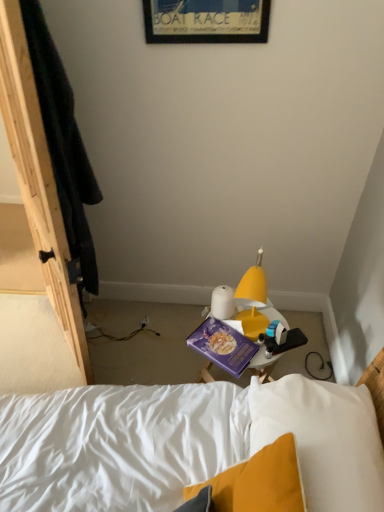
Question: Do you think wooden framed poster at upper center is within purple matte paperback book at center, or outside of it?

Choices:
 (A) outside
 (B) inside

Answer: (A)

Question: Is wooden framed poster at upper center in front of or behind purple matte paperback book at center in the image?

Choices:
 (A) behind
 (B) front

Answer: (B)

Question: Is point (243, 28) positioned closer to the camera than point (249, 349)?

Choices:
 (A) farther
 (B) closer

Answer: (B)

Question: Is purple matte paperback book at center inside the boundaries of wooden framed poster at upper center, or outside?

Choices:
 (A) outside
 (B) inside

Answer: (A)

Question: Looking at their shapes, would you say purple matte paperback book at center is wider or thinner than wooden framed poster at upper center?

Choices:
 (A) wide
 (B) thin

Answer: (A)

Question: Is point (241, 371) closer or farther from the camera than point (213, 32)?

Choices:
 (A) closer
 (B) farther

Answer: (B)

Question: Based on their sizes in the image, would you say purple matte paperback book at center is bigger or smaller than wooden framed poster at upper center?

Choices:
 (A) big
 (B) small

Answer: (B)